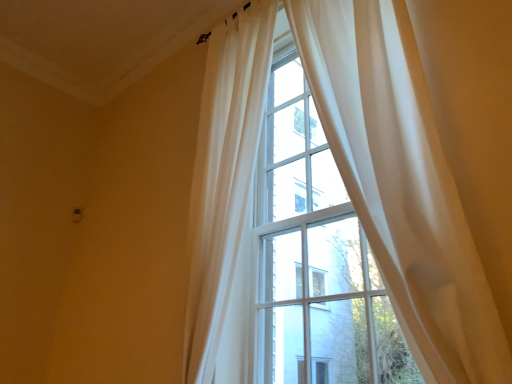
What do you see at coordinates (401, 180) in the screenshot? This screenshot has width=512, height=384. I see `sheer white curtain at upper right, which is counted as the first curtain, starting from the right` at bounding box center [401, 180].

Locate an element on the screen. The height and width of the screenshot is (384, 512). sheer white curtain at upper right, which is the second curtain in left-to-right order is located at coordinates (401, 180).

Where is `sheer white curtain at upper center, which is the second curtain from right to left`? The width and height of the screenshot is (512, 384). sheer white curtain at upper center, which is the second curtain from right to left is located at coordinates (224, 174).

Image resolution: width=512 pixels, height=384 pixels. What do you see at coordinates (224, 174) in the screenshot? I see `sheer white curtain at upper center, which is the second curtain from right to left` at bounding box center [224, 174].

Identify the location of sheer white curtain at upper right, which is the second curtain in left-to-right order. This screenshot has width=512, height=384. (401, 180).

Considering the relative positions of sheer white curtain at upper center, which is the second curtain from right to left, and sheer white curtain at upper right, which is counted as the first curtain, starting from the right, in the image provided, is sheer white curtain at upper center, which is the second curtain from right to left, to the right of sheer white curtain at upper right, which is counted as the first curtain, starting from the right, from the viewer's perspective?

No.

Which is in front, sheer white curtain at upper center, which is the second curtain from right to left, or sheer white curtain at upper right, which is the second curtain in left-to-right order?

sheer white curtain at upper right, which is the second curtain in left-to-right order, is closer to the camera.

Which point is more forward, [255,5] or [194,283]?

The point [194,283] is closer to the camera.

From the image's perspective, which object appears higher, sheer white curtain at upper center, arranged as the 1th curtain when viewed from the left, or sheer white curtain at upper right, which is the second curtain in left-to-right order?

sheer white curtain at upper right, which is the second curtain in left-to-right order.

From a real-world perspective, is sheer white curtain at upper center, arranged as the 1th curtain when viewed from the left, physically above sheer white curtain at upper right, which is the second curtain in left-to-right order?

Correct, in the physical world, sheer white curtain at upper center, arranged as the 1th curtain when viewed from the left, is higher than sheer white curtain at upper right, which is the second curtain in left-to-right order.

Which object is thinner, sheer white curtain at upper center, which is the second curtain from right to left, or sheer white curtain at upper right, which is counted as the first curtain, starting from the right?

sheer white curtain at upper right, which is counted as the first curtain, starting from the right.

Between sheer white curtain at upper center, arranged as the 1th curtain when viewed from the left, and sheer white curtain at upper right, which is counted as the first curtain, starting from the right, which one has more height?

With more height is sheer white curtain at upper center, arranged as the 1th curtain when viewed from the left.

Is sheer white curtain at upper center, which is the second curtain from right to left, bigger than sheer white curtain at upper right, which is the second curtain in left-to-right order?

Indeed, sheer white curtain at upper center, which is the second curtain from right to left, has a larger size compared to sheer white curtain at upper right, which is the second curtain in left-to-right order.

Is sheer white curtain at upper center, which is the second curtain from right to left, completely or partially outside of sheer white curtain at upper right, which is the second curtain in left-to-right order?

That's correct, sheer white curtain at upper center, which is the second curtain from right to left, is outside of sheer white curtain at upper right, which is the second curtain in left-to-right order.

Is sheer white curtain at upper center, arranged as the 1th curtain when viewed from the left, far away from sheer white curtain at upper right, which is counted as the first curtain, starting from the right?

No, sheer white curtain at upper center, arranged as the 1th curtain when viewed from the left, is not far from sheer white curtain at upper right, which is counted as the first curtain, starting from the right.

Looking at this image, is sheer white curtain at upper right, which is the second curtain in left-to-right order, at the back of sheer white curtain at upper center, arranged as the 1th curtain when viewed from the left?

No, sheer white curtain at upper center, arranged as the 1th curtain when viewed from the left, is not facing away from sheer white curtain at upper right, which is the second curtain in left-to-right order.

Can you tell me how much sheer white curtain at upper center, arranged as the 1th curtain when viewed from the left, and sheer white curtain at upper right, which is counted as the first curtain, starting from the right, differ in facing direction?

8.84e-05 degrees.

In order to click on curtain below the sheer white curtain at upper right, which is counted as the first curtain, starting from the right (from the image's perspective) in this screenshot , I will do `click(224, 174)`.

In the image, is sheer white curtain at upper right, which is the second curtain in left-to-right order, on the left side or the right side of sheer white curtain at upper center, which is the second curtain from right to left?

sheer white curtain at upper right, which is the second curtain in left-to-right order, is to the right of sheer white curtain at upper center, which is the second curtain from right to left.

Between sheer white curtain at upper right, which is counted as the first curtain, starting from the right, and sheer white curtain at upper center, arranged as the 1th curtain when viewed from the left, which one is positioned in front?

sheer white curtain at upper right, which is counted as the first curtain, starting from the right, is in front.

Is point (197, 331) positioned behind point (210, 160)?

That is False.

From the image's perspective, which object appears higher, sheer white curtain at upper right, which is the second curtain in left-to-right order, or sheer white curtain at upper center, arranged as the 1th curtain when viewed from the left?

sheer white curtain at upper right, which is the second curtain in left-to-right order, appears higher in the image.

From the picture: From a real-world perspective, is sheer white curtain at upper right, which is counted as the first curtain, starting from the right, on sheer white curtain at upper center, which is the second curtain from right to left?

No, from a real-world perspective, sheer white curtain at upper right, which is counted as the first curtain, starting from the right, is not over sheer white curtain at upper center, which is the second curtain from right to left

Which object is wider, sheer white curtain at upper right, which is counted as the first curtain, starting from the right, or sheer white curtain at upper center, which is the second curtain from right to left?

sheer white curtain at upper center, which is the second curtain from right to left.

Is sheer white curtain at upper right, which is counted as the first curtain, starting from the right, taller or shorter than sheer white curtain at upper center, which is the second curtain from right to left?

sheer white curtain at upper right, which is counted as the first curtain, starting from the right, is shorter than sheer white curtain at upper center, which is the second curtain from right to left.

Looking at this image, can you confirm if sheer white curtain at upper right, which is the second curtain in left-to-right order, is smaller than sheer white curtain at upper center, which is the second curtain from right to left?

Yes, sheer white curtain at upper right, which is the second curtain in left-to-right order, is smaller than sheer white curtain at upper center, which is the second curtain from right to left.

Can sheer white curtain at upper center, which is the second curtain from right to left, be found inside sheer white curtain at upper right, which is the second curtain in left-to-right order?

No, sheer white curtain at upper center, which is the second curtain from right to left, is not a part of sheer white curtain at upper right, which is the second curtain in left-to-right order.

Is sheer white curtain at upper right, which is the second curtain in left-to-right order, beside sheer white curtain at upper center, which is the second curtain from right to left?

No, sheer white curtain at upper right, which is the second curtain in left-to-right order, is not with sheer white curtain at upper center, which is the second curtain from right to left.

Is sheer white curtain at upper right, which is the second curtain in left-to-right order, oriented towards sheer white curtain at upper center, arranged as the 1th curtain when viewed from the left?

No, sheer white curtain at upper right, which is the second curtain in left-to-right order, does not turn towards sheer white curtain at upper center, arranged as the 1th curtain when viewed from the left.

Can you tell me how much sheer white curtain at upper right, which is the second curtain in left-to-right order, and sheer white curtain at upper center, arranged as the 1th curtain when viewed from the left, differ in facing direction?

They differ by 8.84e-05 degrees in their facing directions.

Measure the distance between sheer white curtain at upper right, which is counted as the first curtain, starting from the right, and sheer white curtain at upper center, which is the second curtain from right to left.

9.35 inches.

The height and width of the screenshot is (384, 512). In order to click on curtain behind the sheer white curtain at upper right, which is the second curtain in left-to-right order in this screenshot , I will do `click(224, 174)`.

Locate an element on the screen. curtain below the sheer white curtain at upper center, which is the second curtain from right to left (from a real-world perspective) is located at coordinates (401, 180).

This screenshot has height=384, width=512. What are the coordinates of `curtain below the sheer white curtain at upper right, which is counted as the first curtain, starting from the right (from the image's perspective)` in the screenshot? It's located at (224, 174).